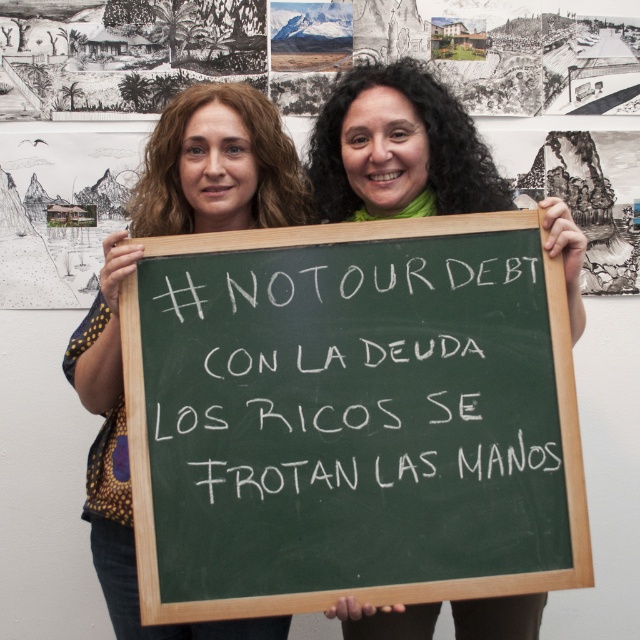
You are attending a protest and see two people holding up a sign. They are holding the green chalkboard at center and the green fabric scarf at center. Which object is positioned to the left?

The green chalkboard at center is to the left of the green fabric scarf at center, so the green chalkboard at center is positioned to the left.

You are organizing a protest and need to decide which item to carry for visibility. The green chalkboard at center and the green fabric scarf at center are both available. Based on their sizes, which one would be more visible from a distance?

The green chalkboard at center is larger in width than the green fabric scarf at center, so it would be more visible from a distance.